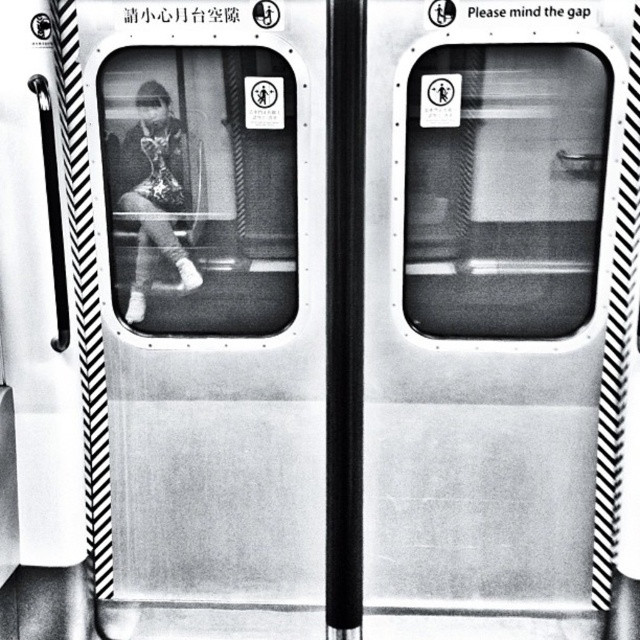
Can you confirm if metallic silver door at left is positioned below matte black jacket at center?

Yes, metallic silver door at left is below matte black jacket at center.

Can you confirm if metallic silver door at left is shorter than matte black jacket at center?

In fact, metallic silver door at left may be taller than matte black jacket at center.

Is point (128, 180) behind point (182, 157)?

Yes.

The height and width of the screenshot is (640, 640). In order to click on metallic silver door at left in this screenshot , I will do `click(214, 307)`.

Which is behind, point (310, 83) or point (326, 214)?

Point (310, 83)

Does point (298, 106) come behind point (339, 420)?

Yes.

Is point (278, 8) positioned after point (358, 216)?

Yes, point (278, 8) is behind point (358, 216).

You are a GUI agent. You are given a task and a screenshot of the screen. Output one action in this format:
    pyautogui.click(x=<x>, y=<y>)
    Task: Click on the metallic silver door at left
    
    Given the screenshot: What is the action you would take?
    pyautogui.click(x=214, y=307)

Which is more to the right, black glossy pole at center or matte black jacket at center?

black glossy pole at center

Is point (353, 550) positioned in front of point (128, 140)?

Yes, point (353, 550) is in front of point (128, 140).

What do you see at coordinates (344, 316) in the screenshot? I see `black glossy pole at center` at bounding box center [344, 316].

Locate an element on the screen. The height and width of the screenshot is (640, 640). black glossy pole at center is located at coordinates (344, 316).